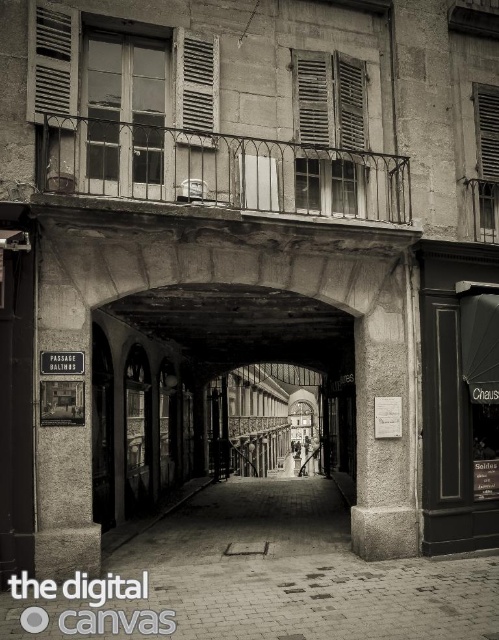
Can you confirm if matte wood shutter at upper center is positioned below matte wood shutter at upper right?

Actually, matte wood shutter at upper center is above matte wood shutter at upper right.

Is point (182, 83) more distant than point (492, 88)?

No, (182, 83) is closer to viewer.

Does point (207, 124) come closer to viewer compared to point (488, 122)?

Yes, point (207, 124) is closer to viewer.

You are a GUI agent. You are given a task and a screenshot of the screen. Output one action in this format:
    pyautogui.click(x=<x>, y=<y>)
    Task: Click on the matte wood shutter at upper center
    The width and height of the screenshot is (499, 640).
    Given the screenshot: What is the action you would take?
    pyautogui.click(x=197, y=90)

Is wooden slats at upper center bigger than matte wood shutter at upper center?

Correct, wooden slats at upper center is larger in size than matte wood shutter at upper center.

Does wooden slats at upper center lie in front of matte wood shutter at upper center?

No, it is behind matte wood shutter at upper center.

Where is `wooden slats at upper center`? This screenshot has width=499, height=640. wooden slats at upper center is located at coordinates (329, 129).

This screenshot has height=640, width=499. Identify the location of wooden slats at upper center. (329, 129).

This screenshot has height=640, width=499. What do you see at coordinates (197, 90) in the screenshot?
I see `matte wood shutter at upper center` at bounding box center [197, 90].

Is matte wood shutter at upper center behind white matte shutter at center?

Yes.

Who is more distant from viewer, (191,61) or (243,196)?

Positioned behind is point (191,61).

Locate an element on the screen. The image size is (499, 640). matte wood shutter at upper center is located at coordinates (197, 90).